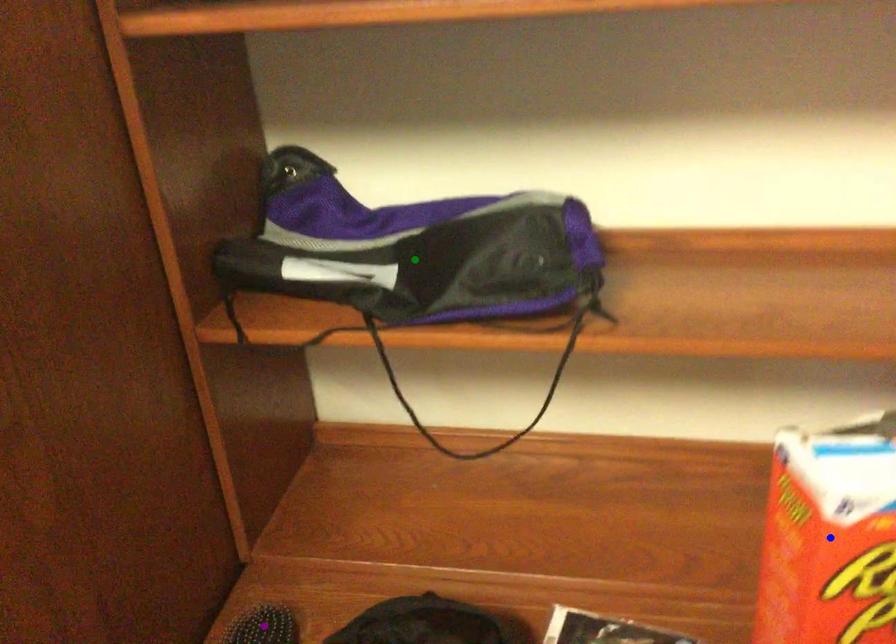
Order these from nearest to farthest:
- green point
- blue point
- purple point

blue point
purple point
green point